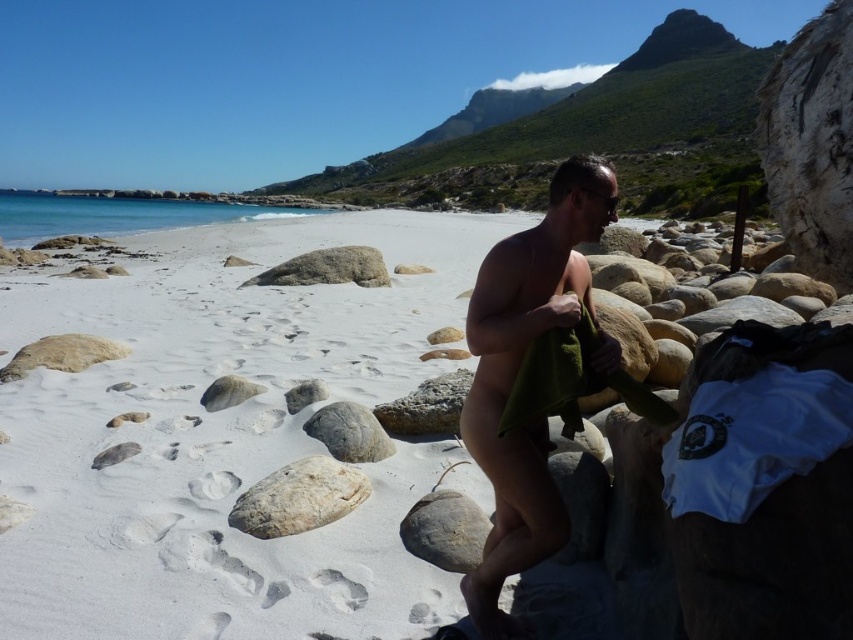
Does white sand at center have a greater height compared to gray rough rock at lower center?

Yes, white sand at center is taller than gray rough rock at lower center.

The width and height of the screenshot is (853, 640). I want to click on white sand at center, so click(225, 436).

Where is `white sand at center`? The height and width of the screenshot is (640, 853). white sand at center is located at coordinates (225, 436).

At what (x,y) coordinates should I click in order to perform the action: click on white sand at center. Please return your answer as a coordinate pair (x, y). The height and width of the screenshot is (640, 853). Looking at the image, I should click on (225, 436).

Identify the location of gray smooth rock at lower left. (299, 497).

Is gray smooth rock at lower left in front of smooth gray rock at center?

That is True.

This screenshot has height=640, width=853. What are the coordinates of `gray smooth rock at lower left` in the screenshot? It's located at (299, 497).

This screenshot has height=640, width=853. I want to click on gray smooth rock at lower left, so click(299, 497).

Does gray rough rock at center have a lesser height compared to gray smooth rock at center?

In fact, gray rough rock at center may be taller than gray smooth rock at center.

What do you see at coordinates (349, 433) in the screenshot? I see `gray rough rock at center` at bounding box center [349, 433].

Locate an element on the screen. gray rough rock at center is located at coordinates (349, 433).